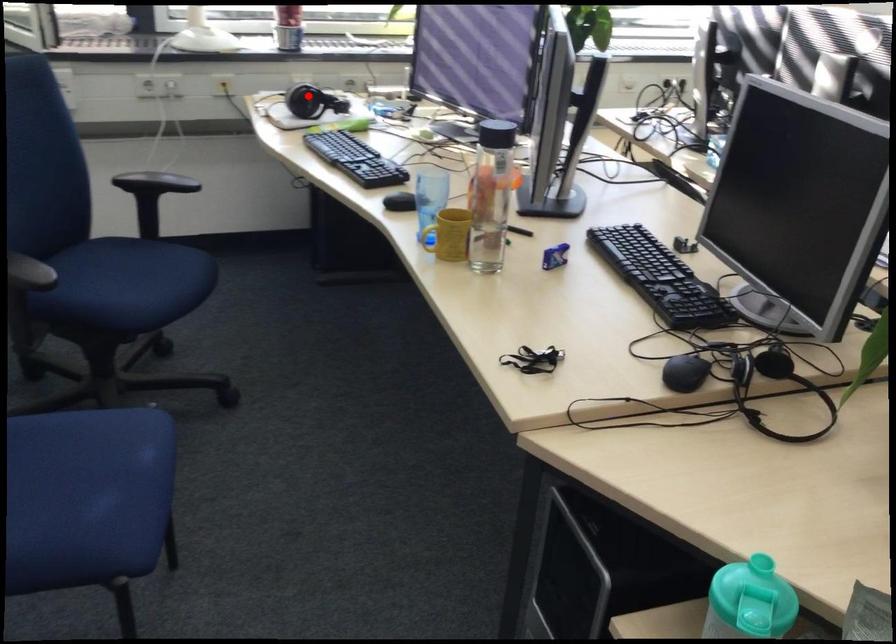
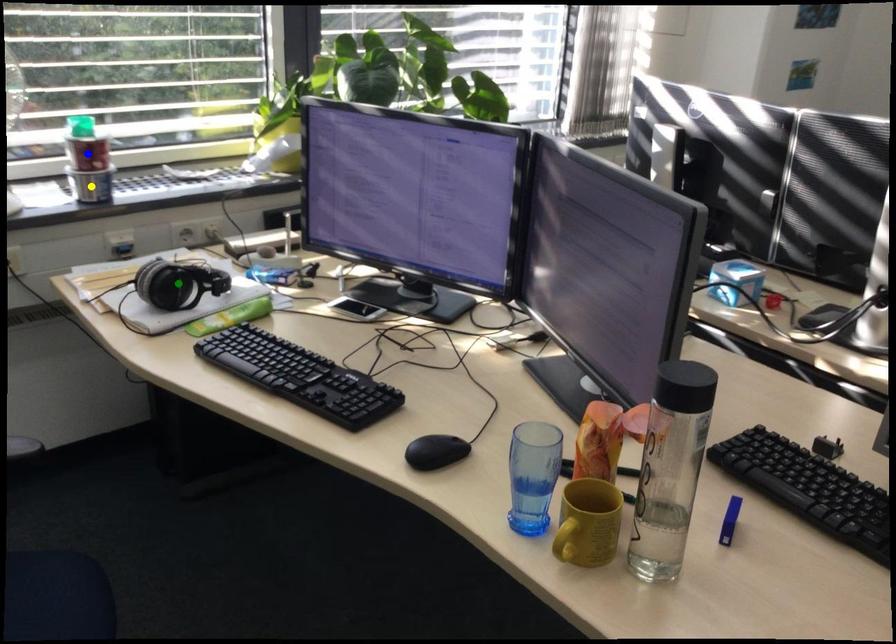
Question: I am providing you with two images of the same scene from different viewpoints. A red point is marked on the first image. You are given multiple points on the second image. Which mark in image 2 goes with the point in image 1?

Choices:
 (A) green point
 (B) blue point
 (C) yellow point

Answer: (A)